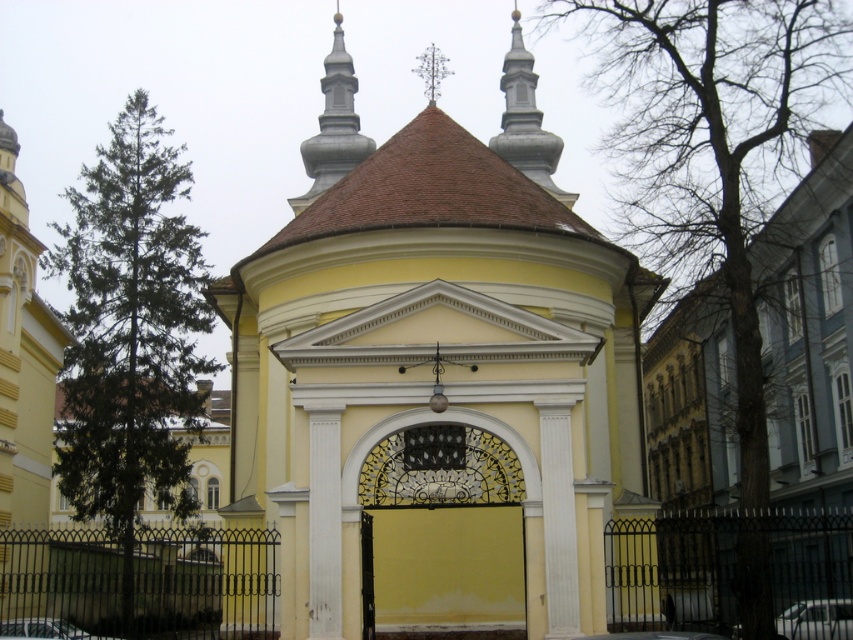
Is yellow matte wall at center above metallic silver car at lower right?

Yes, yellow matte wall at center is above metallic silver car at lower right.

Which is in front, point (459, 602) or point (792, 608)?

Point (792, 608) is in front.

Where is `yellow matte wall at center`? The height and width of the screenshot is (640, 853). yellow matte wall at center is located at coordinates (448, 572).

Between yellow matte chapel at center and metallic silver car at lower right, which one appears on the left side from the viewer's perspective?

Positioned to the left is yellow matte chapel at center.

The width and height of the screenshot is (853, 640). I want to click on yellow matte chapel at center, so click(x=436, y=376).

At what (x,y) coordinates should I click in order to perform the action: click on yellow matte chapel at center. Please return your answer as a coordinate pair (x, y). Looking at the image, I should click on (436, 376).

Image resolution: width=853 pixels, height=640 pixels. What do you see at coordinates (436, 376) in the screenshot?
I see `yellow matte chapel at center` at bounding box center [436, 376].

Is yellow matte chapel at center to the right of wrought iron gate at center from the viewer's perspective?

Incorrect, yellow matte chapel at center is not on the right side of wrought iron gate at center.

The image size is (853, 640). What do you see at coordinates (436, 376) in the screenshot?
I see `yellow matte chapel at center` at bounding box center [436, 376].

At what (x,y) coordinates should I click in order to perform the action: click on yellow matte chapel at center. Please return your answer as a coordinate pair (x, y). Looking at the image, I should click on (436, 376).